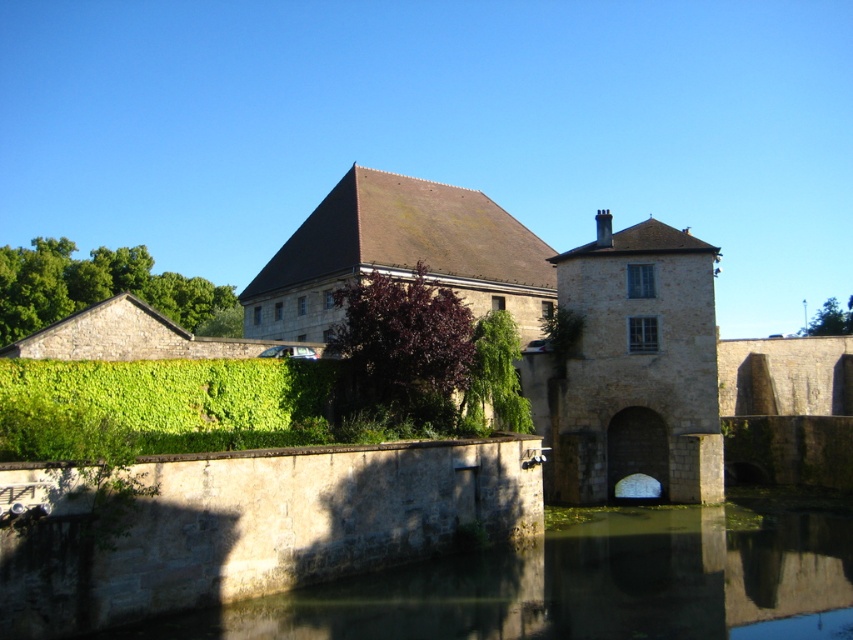
Question: Is green leafy hedge at center bigger than green leafy hedge at upper left?

Choices:
 (A) yes
 (B) no

Answer: (B)

Question: Can you confirm if green leafy hedge at lower left is positioned above green leafy hedge at upper left?

Choices:
 (A) no
 (B) yes

Answer: (A)

Question: Does green leafy hedge at lower left have a smaller size compared to green leafy hedge at center?

Choices:
 (A) yes
 (B) no

Answer: (A)

Question: Which object is closer to the camera taking this photo?

Choices:
 (A) green leafy hedge at center
 (B) green leafy hedge at upper left
 (C) green leafy hedge at lower left

Answer: (C)

Question: Which point appears closest to the camera in this image?

Choices:
 (A) (218, 317)
 (B) (236, 385)

Answer: (B)

Question: Which object appears farthest from the camera in this image?

Choices:
 (A) green leafy hedge at lower left
 (B) green leafy hedge at upper left
 (C) green leafy hedge at center

Answer: (B)